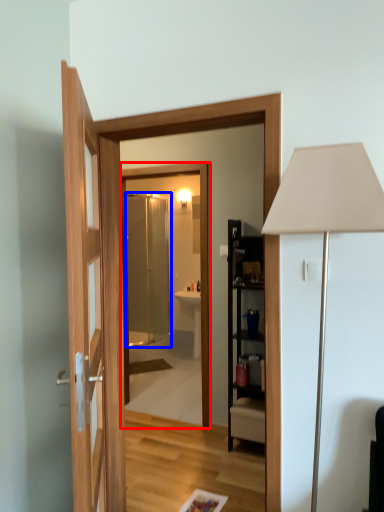
Question: Which object is closer to the camera taking this photo, mirror (highlighted by a red box) or screen door (highlighted by a blue box)?

Choices:
 (A) mirror
 (B) screen door

Answer: (A)